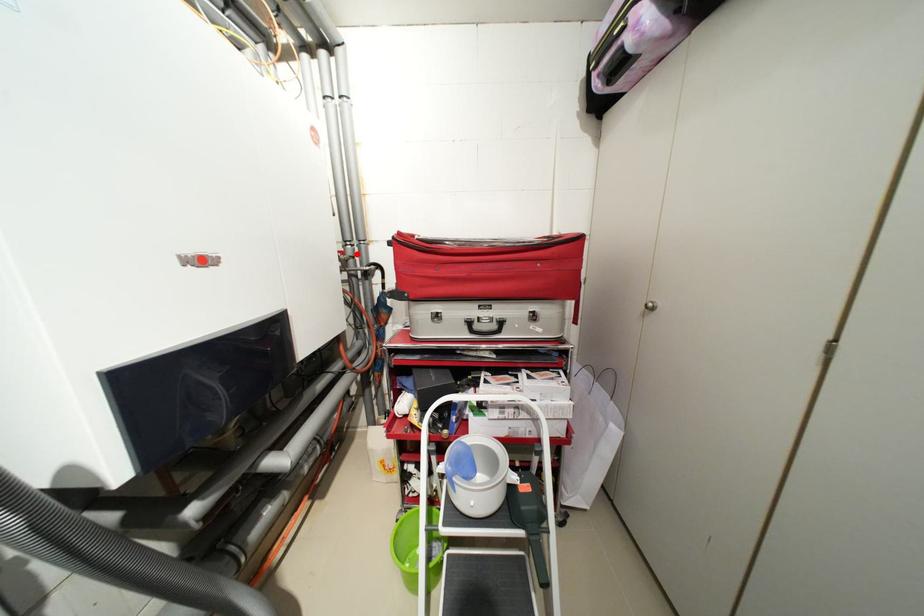
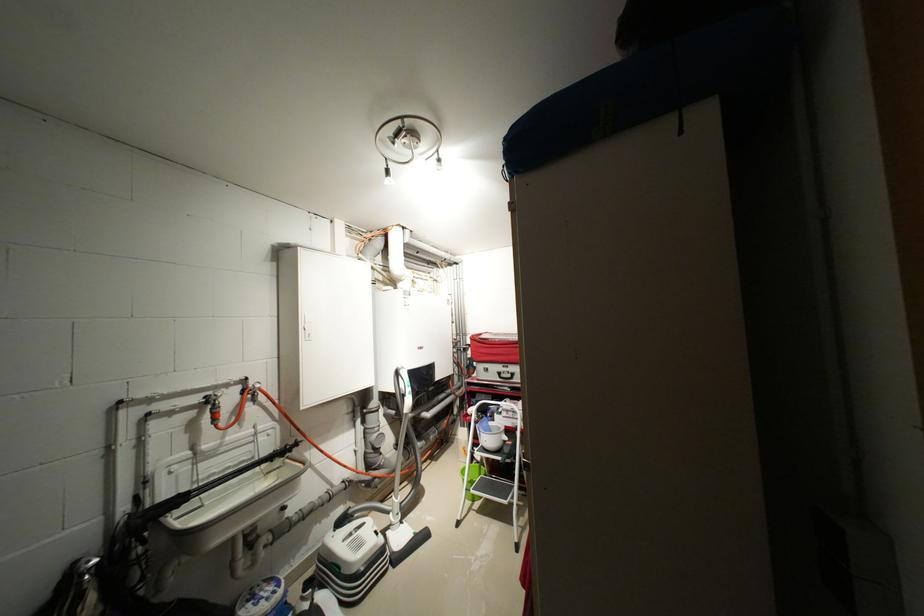
Question: I am providing you with two images of the same scene from different viewpoints. A red point is shown in image1. For the corresponding object point in image2, is it positioned nearer or farther from the camera?

Choices:
 (A) Nearer
 (B) Farther

Answer: (B)